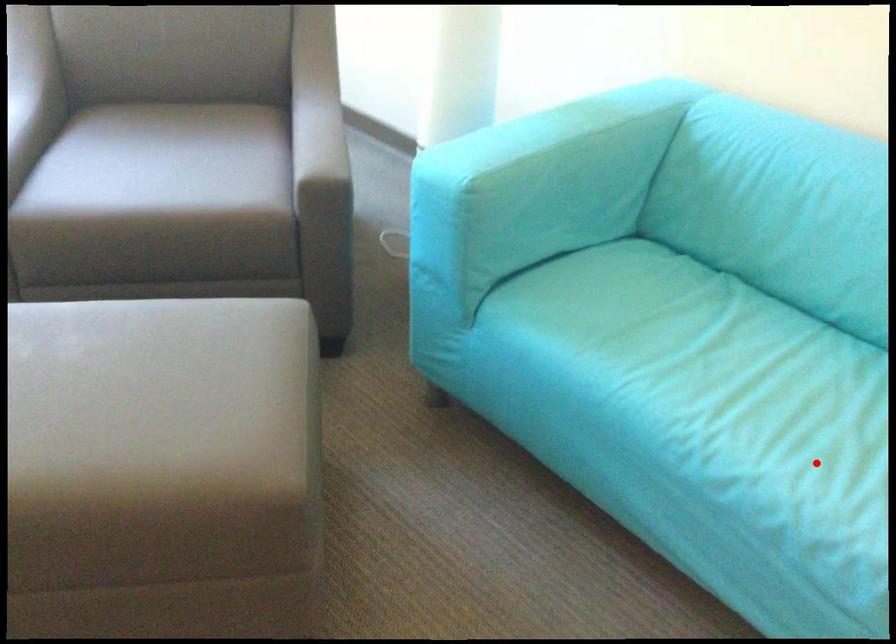
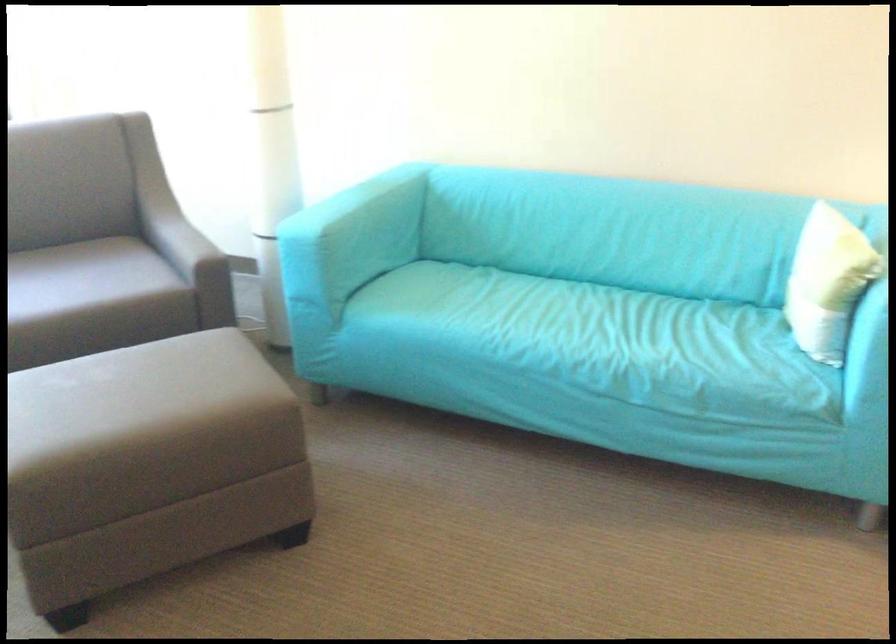
Locate, in the second image, the point that corresponds to the highlighted location in the first image.

(556, 328)